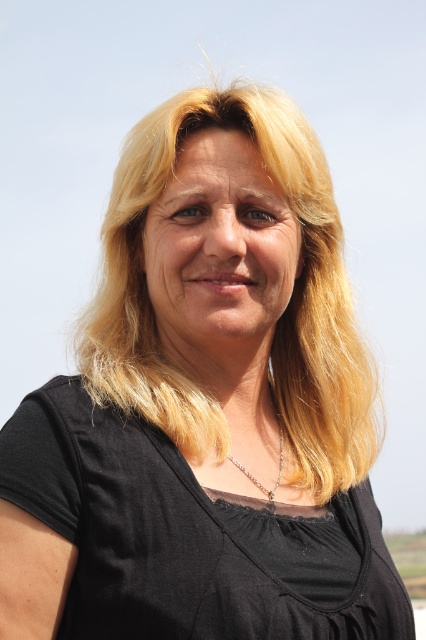
Can you confirm if black matte dress at center is positioned above silver metallic necklace at center?

Incorrect, black matte dress at center is not positioned above silver metallic necklace at center.

Who is more forward, (75, 536) or (233, 460)?

Point (75, 536) is in front.

Which is behind, point (8, 499) or point (279, 445)?

The point (279, 445) is behind.

This screenshot has width=426, height=640. Identify the location of black matte dress at center. (180, 536).